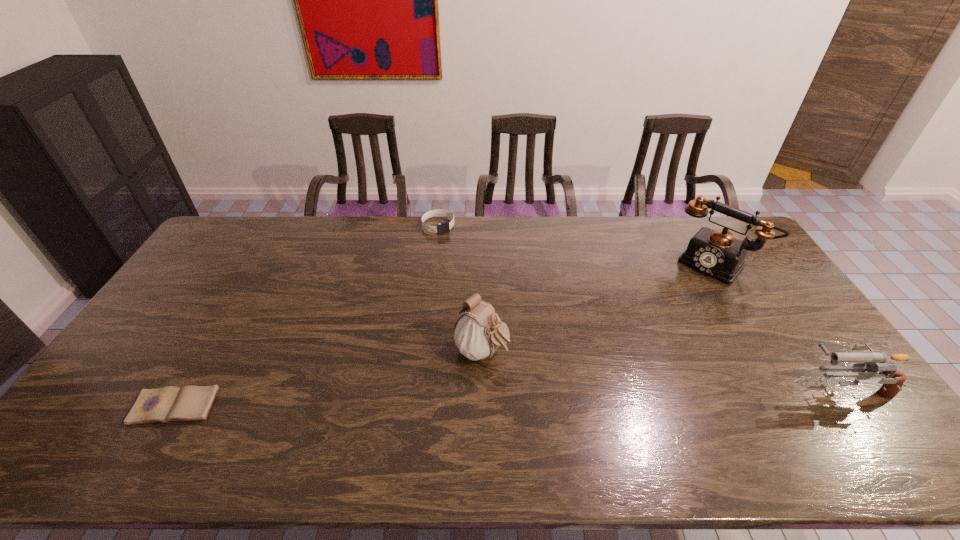
At what (x,y) coordinates should I click in order to perform the action: click on object that is positioned at the near right corner. Please return your answer as a coordinate pair (x, y). Looking at the image, I should click on (872, 362).

Where is `free location at the far edge`? This screenshot has height=540, width=960. free location at the far edge is located at coordinates (519, 238).

In order to click on vacant space at the near edge of the desktop in this screenshot , I will do `click(774, 421)`.

Where is `vacant space at the left edge of the desktop`? vacant space at the left edge of the desktop is located at coordinates (195, 295).

Where is `vacant space at the right edge`? This screenshot has height=540, width=960. vacant space at the right edge is located at coordinates (765, 282).

You are a GUI agent. You are given a task and a screenshot of the screen. Output one action in this format:
    pyautogui.click(x=<x>, y=<y>)
    Task: Click on the vacant space that's between the pouch and the wristband
    
    Given the screenshot: What is the action you would take?
    pyautogui.click(x=460, y=289)

At what (x,y) coordinates should I click in order to perform the action: click on free space between the gun and the third object from left to right. Please return your answer as a coordinate pair (x, y). The image size is (960, 540). Looking at the image, I should click on (662, 370).

Where is `vacant space that's between the diary and the pouch`? This screenshot has width=960, height=540. vacant space that's between the diary and the pouch is located at coordinates (327, 379).

Locate an element on the screen. The width and height of the screenshot is (960, 540). free spot between the third object from left to right and the farthest object is located at coordinates (460, 289).

Locate an element on the screen. vacant space that is in between the farthest object and the third tallest object is located at coordinates (641, 307).